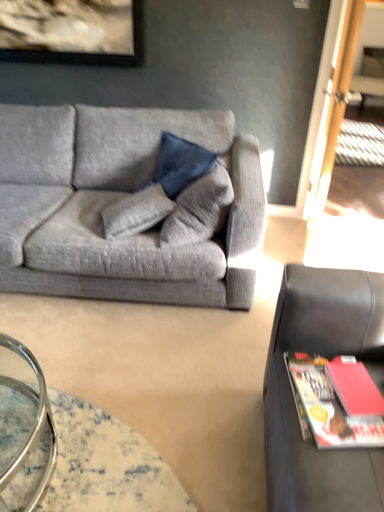
Question: Does matte red book at lower right turn towards black leather studio couch at right, acting as the second studio couch starting from the left?

Choices:
 (A) no
 (B) yes

Answer: (B)

Question: Is matte red book at lower right further to camera compared to black leather studio couch at right, which ranks as the 1th studio couch in right-to-left order?

Choices:
 (A) yes
 (B) no

Answer: (A)

Question: Does matte red book at lower right have a greater height compared to black leather studio couch at right, which ranks as the 1th studio couch in right-to-left order?

Choices:
 (A) no
 (B) yes

Answer: (A)

Question: Can you confirm if matte red book at lower right is smaller than black leather studio couch at right, which ranks as the 1th studio couch in right-to-left order?

Choices:
 (A) no
 (B) yes

Answer: (B)

Question: Is black leather studio couch at right, positioned as the first studio couch in front-to-back order, inside matte red book at lower right?

Choices:
 (A) no
 (B) yes

Answer: (A)

Question: From their relative heights in the image, would you say matte red book at lower right is taller or shorter than red matte magazine at right?

Choices:
 (A) tall
 (B) short

Answer: (A)

Question: Based on their sizes in the image, would you say matte red book at lower right is bigger or smaller than red matte magazine at right?

Choices:
 (A) small
 (B) big

Answer: (A)

Question: In the image, is matte red book at lower right positioned in front of or behind red matte magazine at right?

Choices:
 (A) front
 (B) behind

Answer: (B)

Question: From a real-world perspective, is matte red book at lower right physically located above or below red matte magazine at right?

Choices:
 (A) below
 (B) above

Answer: (B)

Question: Considering the positions of translucent glass table at lower left and matte red book at lower right in the image, is translucent glass table at lower left taller or shorter than matte red book at lower right?

Choices:
 (A) short
 (B) tall

Answer: (B)

Question: Considering the relative positions of translucent glass table at lower left and matte red book at lower right in the image provided, is translucent glass table at lower left to the left or to the right of matte red book at lower right?

Choices:
 (A) right
 (B) left

Answer: (B)

Question: From the image's perspective, is translucent glass table at lower left positioned above or below matte red book at lower right?

Choices:
 (A) below
 (B) above

Answer: (A)

Question: Looking at the image, does translucent glass table at lower left seem bigger or smaller compared to matte red book at lower right?

Choices:
 (A) big
 (B) small

Answer: (A)

Question: From the image's perspective, is black leather studio couch at right, which appears as the second studio couch when viewed from the back, above or below textured gray couch at left, which is counted as the second studio couch, starting from the right?

Choices:
 (A) below
 (B) above

Answer: (A)

Question: In terms of height, does black leather studio couch at right, acting as the second studio couch starting from the left, look taller or shorter compared to textured gray couch at left, the 2th studio couch when ordered from front to back?

Choices:
 (A) short
 (B) tall

Answer: (B)